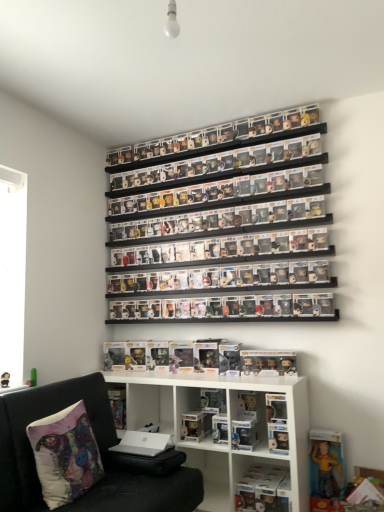
Question: Does translucent plastic figures at lower center, marked as the second toy in a right-to-left arrangement, come behind black fabric couch at lower left?

Choices:
 (A) yes
 (B) no

Answer: (A)

Question: Is translucent plastic figures at lower center, marked as the second toy in a left-to-right arrangement, bigger than black fabric couch at lower left?

Choices:
 (A) yes
 (B) no

Answer: (B)

Question: Considering the relative positions of translucent plastic figures at lower center, acting as the third toy starting from the bottom, and black fabric couch at lower left in the image provided, is translucent plastic figures at lower center, acting as the third toy starting from the bottom, to the left of black fabric couch at lower left from the viewer's perspective?

Choices:
 (A) no
 (B) yes

Answer: (A)

Question: Is translucent plastic figures at lower center, acting as the third toy starting from the bottom, facing away from black fabric couch at lower left?

Choices:
 (A) no
 (B) yes

Answer: (A)

Question: Can you confirm if translucent plastic figures at lower center, marked as the second toy in a left-to-right arrangement, is thinner than black fabric couch at lower left?

Choices:
 (A) yes
 (B) no

Answer: (A)

Question: From a real-world perspective, is translucent plastic figures at lower center, marked as the first toy in a top-to-bottom arrangement, physically above black fabric couch at lower left?

Choices:
 (A) no
 (B) yes

Answer: (B)

Question: Does clear plastic figures at center, which appears as the 2th shelf when viewed from the top, have a lesser height compared to yellow fabric figure at lower right, which is the third toy from top to bottom?

Choices:
 (A) yes
 (B) no

Answer: (A)

Question: Is clear plastic figures at center, which ranks as the third shelf in bottom-to-top order, positioned with its back to yellow fabric figure at lower right, acting as the first toy starting from the right?

Choices:
 (A) no
 (B) yes

Answer: (A)

Question: Does clear plastic figures at center, which appears as the 2th shelf when viewed from the top, come in front of yellow fabric figure at lower right, acting as the 1th toy starting from the bottom?

Choices:
 (A) no
 (B) yes

Answer: (A)

Question: Is clear plastic figures at center, which appears as the 2th shelf when viewed from the top, next to yellow fabric figure at lower right, acting as the 1th toy starting from the bottom?

Choices:
 (A) yes
 (B) no

Answer: (B)

Question: From the image's perspective, is clear plastic figures at center, which appears as the 2th shelf when viewed from the top, below yellow fabric figure at lower right, which is the 3th toy from left to right?

Choices:
 (A) no
 (B) yes

Answer: (A)

Question: Is clear plastic figures at center, which ranks as the third shelf in bottom-to-top order, aimed at yellow fabric figure at lower right, which is the third toy from top to bottom?

Choices:
 (A) no
 (B) yes

Answer: (A)

Question: Can you confirm if clear plastic figures at upper center, the fourth shelf ordered from the bottom, is taller than clear plastic figure at lower center?

Choices:
 (A) yes
 (B) no

Answer: (B)